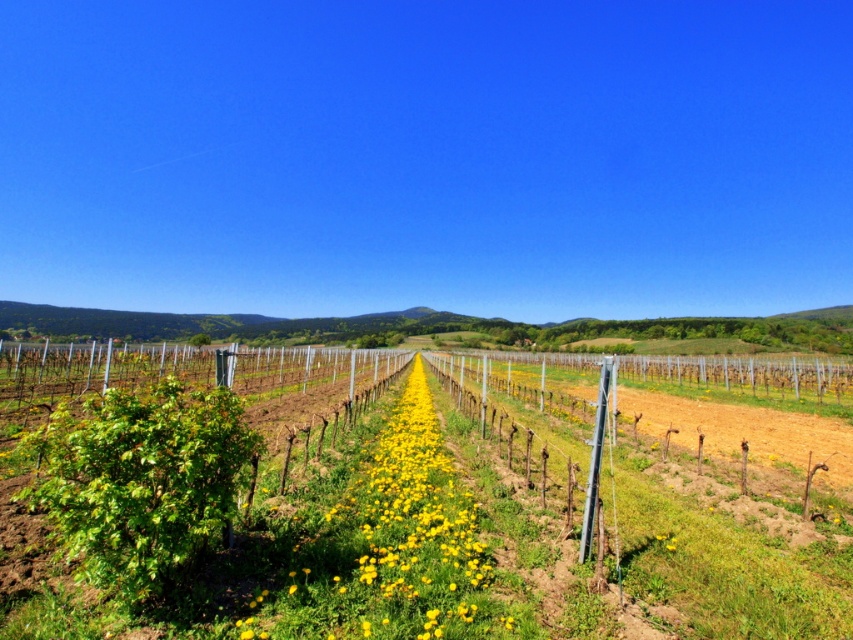
Looking at this image, you are standing at the center of the vineyard looking towards the rows of grapevines. There is a point marked at coordinates (451, 545). What is located at this point?

The point at coordinates (451, 545) indicates green leafy vines at center.